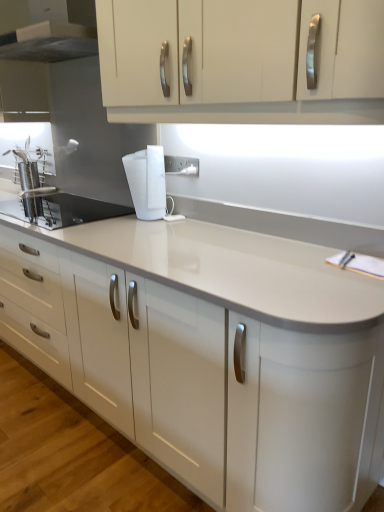
Question: From a real-world perspective, is white plastic electric outlet at center positioned under white glossy cabinet at upper center based on gravity?

Choices:
 (A) yes
 (B) no

Answer: (A)

Question: Is white plastic electric outlet at center to the right of white glossy cabinet at upper center from the viewer's perspective?

Choices:
 (A) no
 (B) yes

Answer: (A)

Question: Is white plastic electric outlet at center looking in the opposite direction of white glossy cabinet at upper center?

Choices:
 (A) no
 (B) yes

Answer: (A)

Question: From the image's perspective, is white plastic electric outlet at center above white glossy cabinet at upper center?

Choices:
 (A) no
 (B) yes

Answer: (A)

Question: Could you tell me if white plastic electric outlet at center is turned towards white glossy cabinet at upper center?

Choices:
 (A) yes
 (B) no

Answer: (B)

Question: Looking at their shapes, would you say white plastic electric outlet at center is wider or thinner than white glossy countertop at center?

Choices:
 (A) wide
 (B) thin

Answer: (B)

Question: Based on their sizes in the image, would you say white plastic electric outlet at center is bigger or smaller than white glossy countertop at center?

Choices:
 (A) big
 (B) small

Answer: (B)

Question: From a real-world perspective, relative to white glossy countertop at center, is white plastic electric outlet at center vertically above or below?

Choices:
 (A) above
 (B) below

Answer: (A)

Question: Do you think white plastic electric outlet at center is within white glossy countertop at center, or outside of it?

Choices:
 (A) outside
 (B) inside

Answer: (A)

Question: Looking at the image, does white plastic electric outlet at center seem bigger or smaller compared to satin steel sink at left?

Choices:
 (A) small
 (B) big

Answer: (A)

Question: Is white plastic electric outlet at center in front of or behind satin steel sink at left in the image?

Choices:
 (A) front
 (B) behind

Answer: (B)

Question: Would you say white plastic electric outlet at center is inside or outside satin steel sink at left?

Choices:
 (A) inside
 (B) outside

Answer: (B)

Question: Is point (177, 164) closer or farther from the camera than point (77, 217)?

Choices:
 (A) closer
 (B) farther

Answer: (A)

Question: Based on their sizes in the image, would you say brushed metal range hood at upper left is bigger or smaller than white glossy countertop at center?

Choices:
 (A) big
 (B) small

Answer: (B)

Question: Is brushed metal range hood at upper left spatially inside white glossy countertop at center, or outside of it?

Choices:
 (A) outside
 (B) inside

Answer: (A)